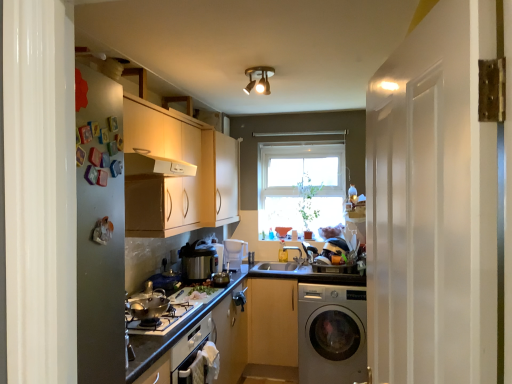
Where is `blank space above brass/bronze finish spotlight at upper center (from a real-world perspective)`? blank space above brass/bronze finish spotlight at upper center (from a real-world perspective) is located at coordinates (262, 69).